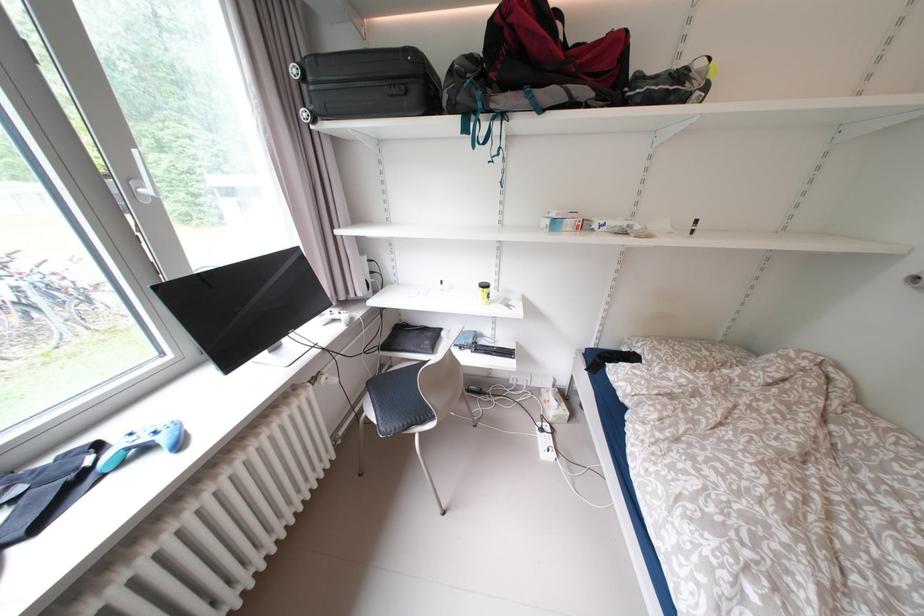
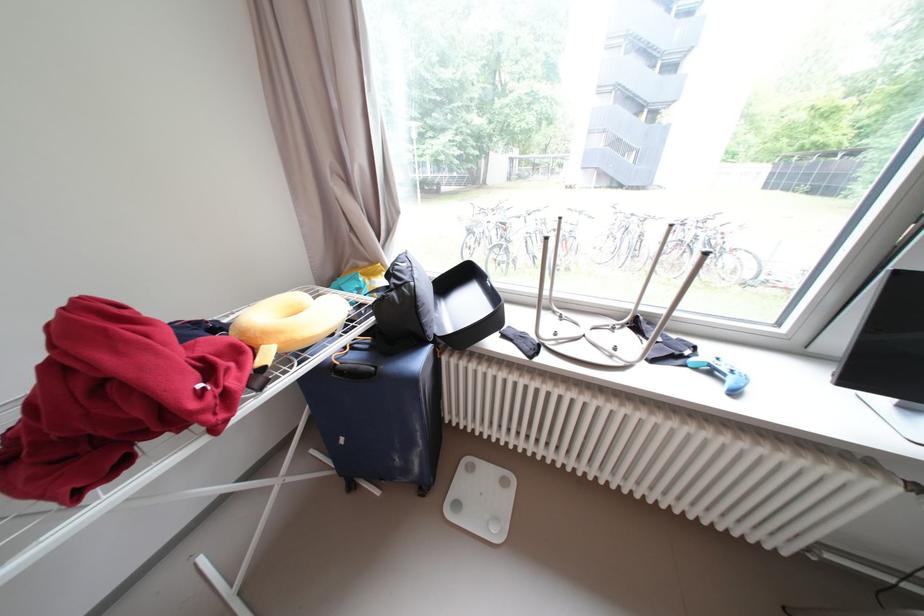
First-person continuous shooting, in which direction is the camera rotating?

The camera rotated toward left-down.